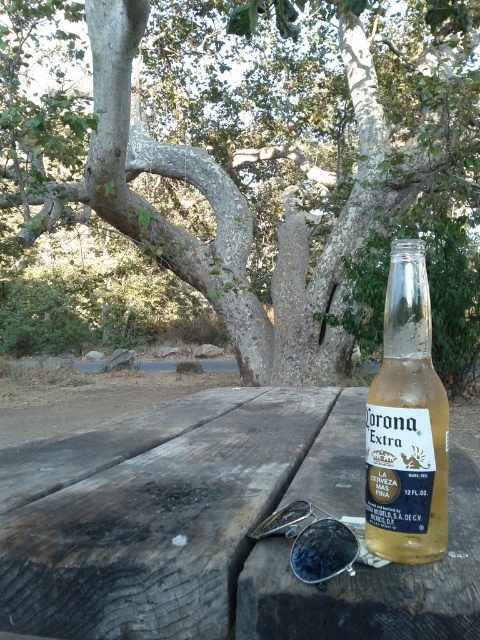
You are planning to place a small vase on the picnic table. The vase is 10 cm wide. The wooden at center and the translucent glass bottle at center are already on the table. Can the vase fit between them without overlapping?

The wooden at center is wider than the translucent glass bottle at center. Since the vase is 10 cm wide, you need to check the space between them. If the distance between the edges of the wooden at center and the translucent glass bottle at center is at least 10 cm, the vase can fit. However, without knowing the exact distance, it is uncertain. The answer depends on the available space between them.

In the scene shown: You are planning to place a small decorative item on the table between the smooth gray bark tree at center and the translucent glass bottle at center. Which object should you place it closer to if you want the item to be closer to the larger object?

The translucent glass bottle at center is larger than the smooth gray bark tree at center. Therefore, placing the decorative item closer to the translucent glass bottle at center would position it near the larger object.

You are standing at point [238,186] in the park. What object is located exactly at your current position?

The smooth gray bark tree at center is located exactly at point [238,186].